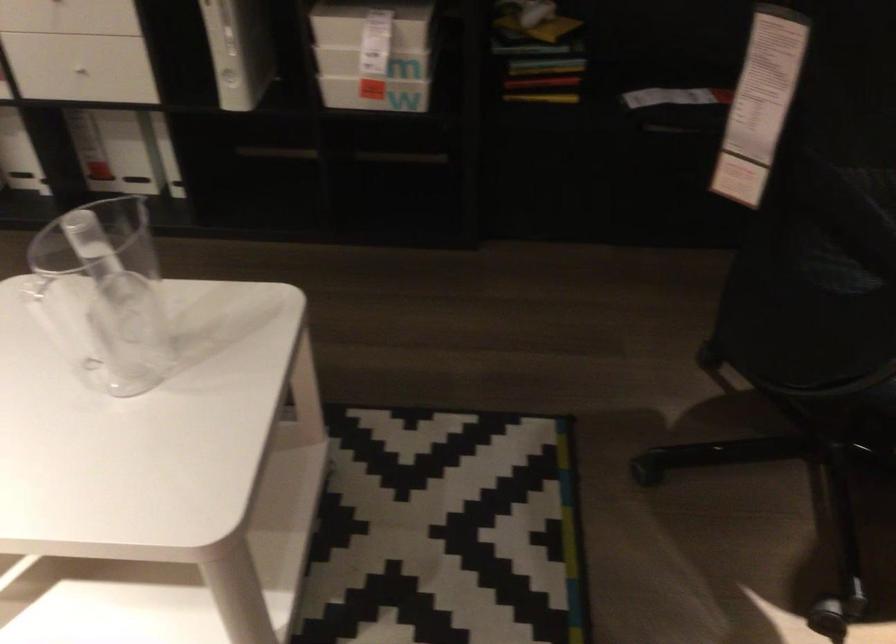
Where would you sit the chair sitting surface? Please return your answer as a coordinate pair (x, y).

(837, 364)